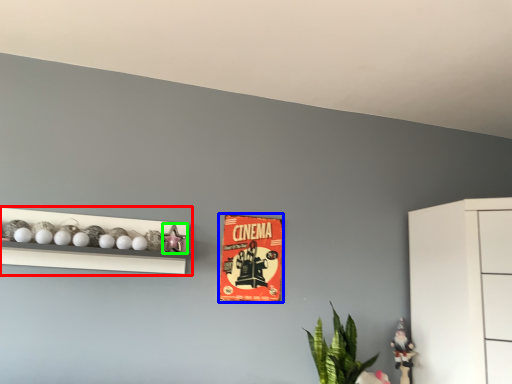
Question: Estimate the real-world distances between objects in this image. Which object is closer to shelf (highlighted by a red box), postcard (highlighted by a blue box) or toy (highlighted by a green box)?

Choices:
 (A) postcard
 (B) toy

Answer: (B)